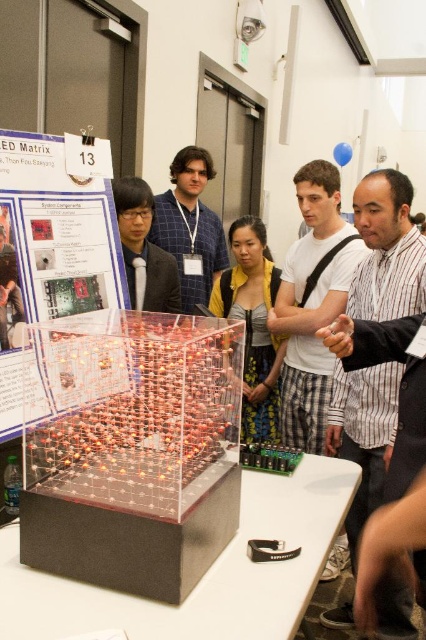
You are setting up a new exhibit and need to place a rectangular box that is 10 cm thick between the transparent acrylic cube at center and the white matte table at center. Based on their thickness, will there be enough space for the box?

The transparent acrylic cube at center is thinner than the white matte table at center. The combined thickness of the cube and table would leave space between them, but since the box is 10 cm thick, we need to know the exact dimensions to confirm. However, since the cube is thinner, if the gap between them is at least 10 cm, the box would fit. Without specific measurements, we can infer that if the cube is thinner, the space might accommodate the box depending on their actual thickness difference.

You are a visitor at the tech exhibition and want to take a photo of the transparent acrylic cube at center. Your camera requires a minimum distance of 1.0 meters to focus properly. Can you stand at your current position and take a clear photo?

The transparent acrylic cube at center is 1.04 meters away from you, which is slightly more than the required 1.0 meters. Therefore, you can take a clear photo from your current position.

You are attending a tech exhibition and see the transparent acrylic cube at center and the clear plastic poster at center. Which object is closer to you?

The transparent acrylic cube at center is closer to you than the clear plastic poster at center.